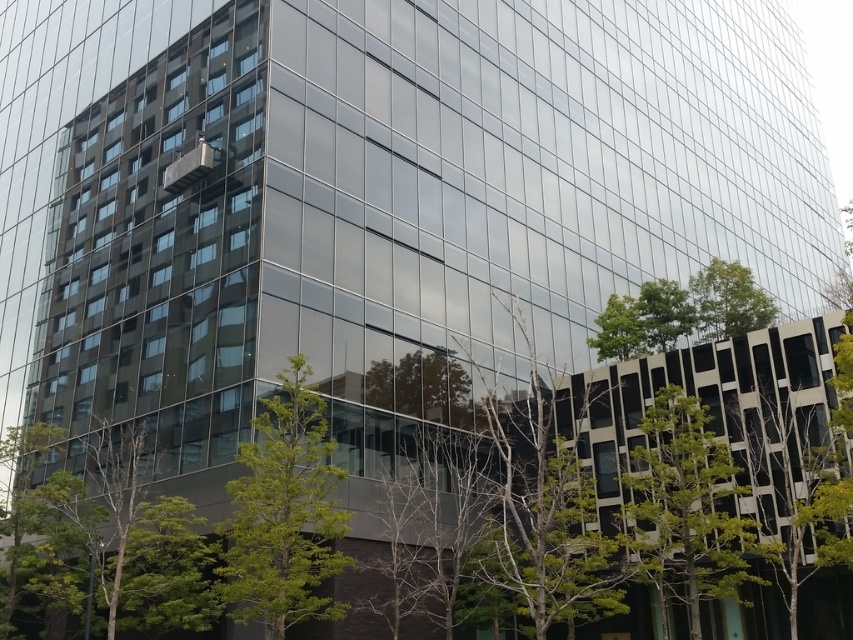
Question: Which point is farther to the camera?

Choices:
 (A) (631, 513)
 (B) (325, 544)

Answer: (A)

Question: Does green leafy tree at center appear on the left side of green leafy tree at lower right?

Choices:
 (A) no
 (B) yes

Answer: (B)

Question: Can you confirm if green leafy tree at center is positioned to the left of green leafy tree at lower right?

Choices:
 (A) no
 (B) yes

Answer: (B)

Question: Does green leafy tree at center appear on the left side of green leafy tree at lower right?

Choices:
 (A) no
 (B) yes

Answer: (B)

Question: Which point appears closest to the camera in this image?

Choices:
 (A) (728, 579)
 (B) (247, 513)

Answer: (B)